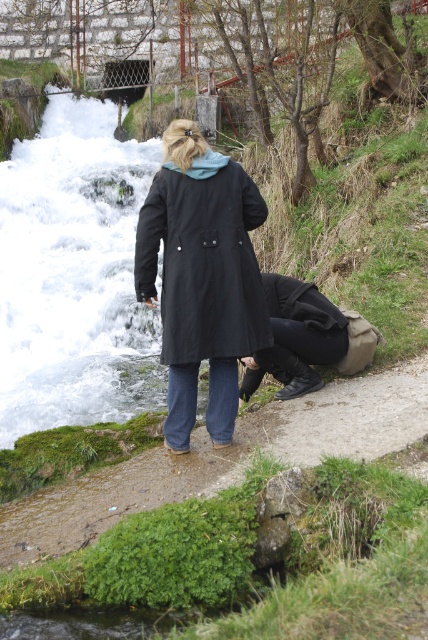
Question: In this image, where is mossy concrete path at lower center located relative to black fabric bag at lower center?

Choices:
 (A) right
 (B) left

Answer: (B)

Question: Is mossy concrete path at lower center to the left of black matte coat at center from the viewer's perspective?

Choices:
 (A) no
 (B) yes

Answer: (A)

Question: Does mossy concrete path at lower center come behind black matte coat at center?

Choices:
 (A) yes
 (B) no

Answer: (B)

Question: Which object is farther from the camera taking this photo?

Choices:
 (A) black matte coat at center
 (B) black fabric bag at lower center
 (C) mossy concrete path at lower center

Answer: (B)

Question: Which point appears closest to the camera in this image?

Choices:
 (A) (288, 362)
 (B) (163, 189)

Answer: (B)

Question: Which object is farther from the camera taking this photo?

Choices:
 (A) black matte coat at center
 (B) black fabric bag at lower center

Answer: (B)